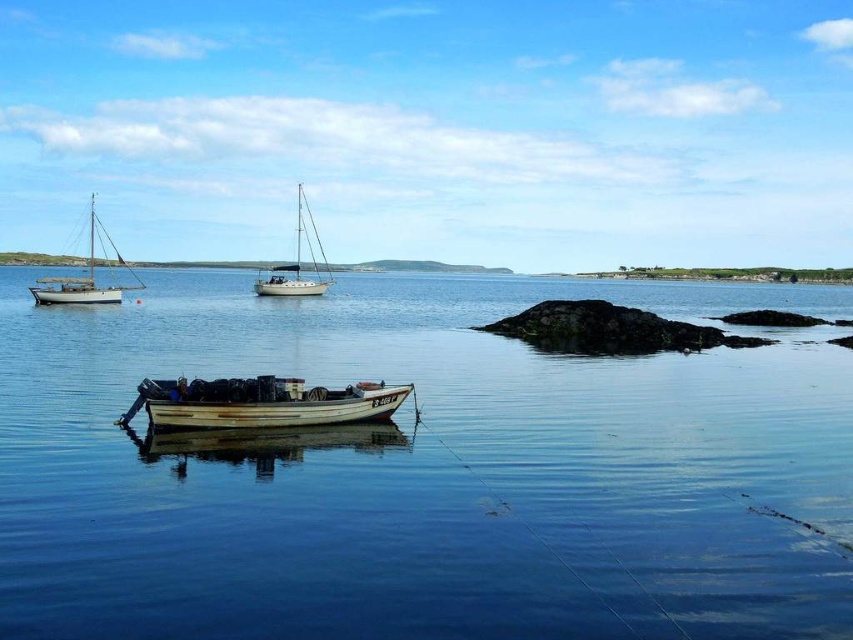
You are a sailor planning to anchor your boat in the clear water at center. The white glossy sailboat at center is currently anchored there. Can you safely anchor your boat there if your boat requires 30 meters of space?

The distance of clear water at center from white glossy sailboat at center is 30.49 meters. Since your boat requires 30 meters of space, you can safely anchor there as the distance is sufficient.